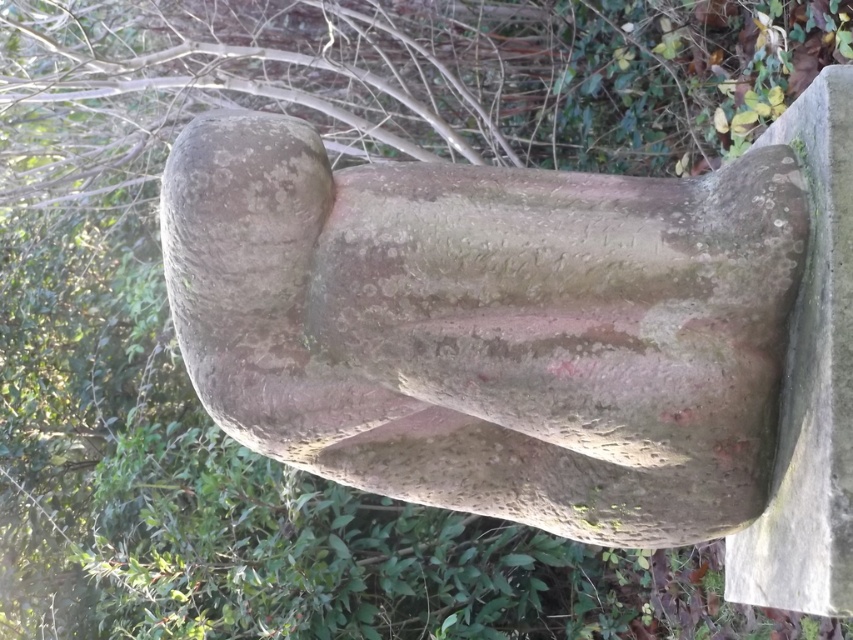
Is speckled stone statue at center smaller than speckled concrete bench at right?

Incorrect, speckled stone statue at center is not smaller in size than speckled concrete bench at right.

Does point (737, 259) lie in front of point (724, 570)?

Yes, point (737, 259) is in front of point (724, 570).

The height and width of the screenshot is (640, 853). In order to click on speckled stone statue at center in this screenshot , I will do `click(489, 326)`.

Find the location of `speckled stone statue at center`. speckled stone statue at center is located at coordinates (489, 326).